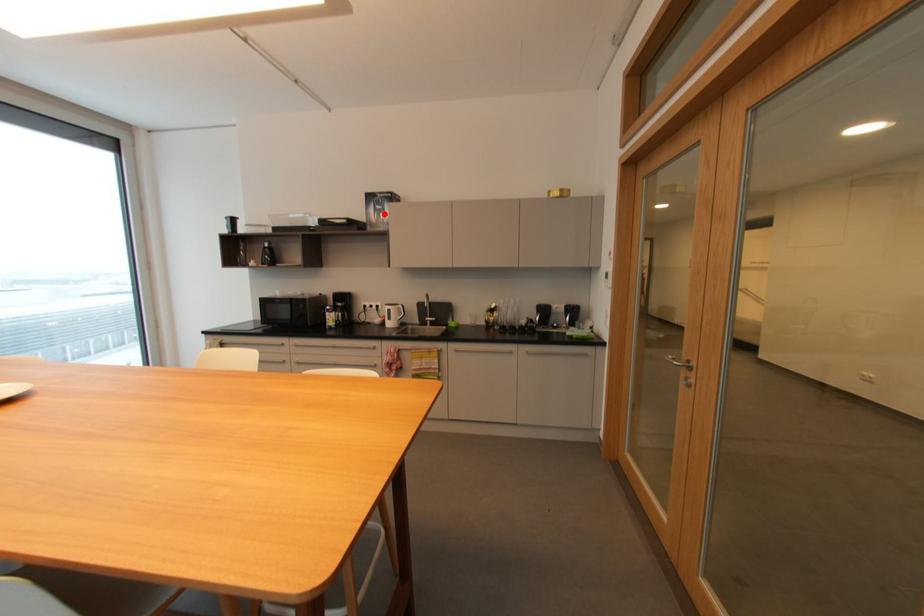
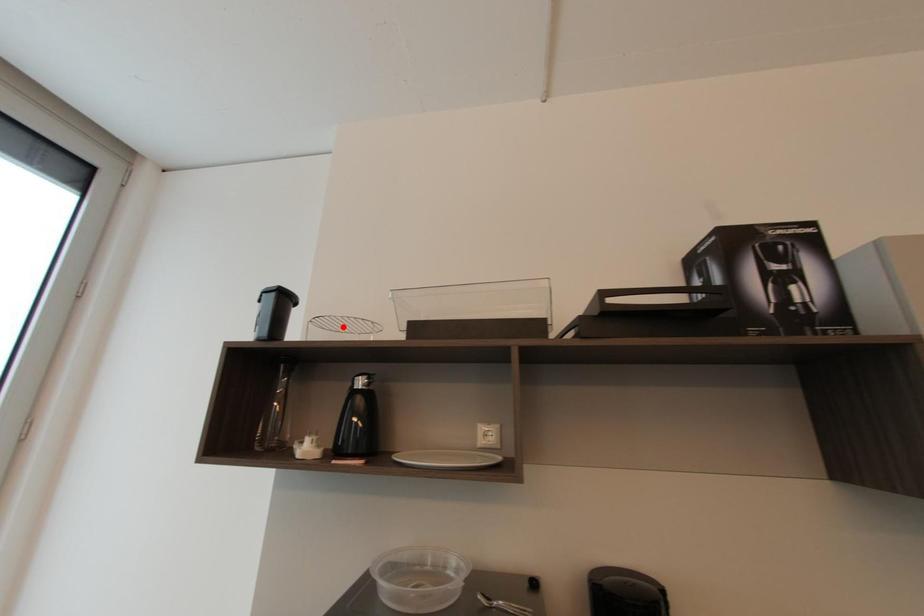
I am providing you with two images of the same scene from different viewpoints. A red point is marked on the first image and another point is marked on the second image. Do the highlighted points in image1 and image2 indicate the same real-world spot?

No